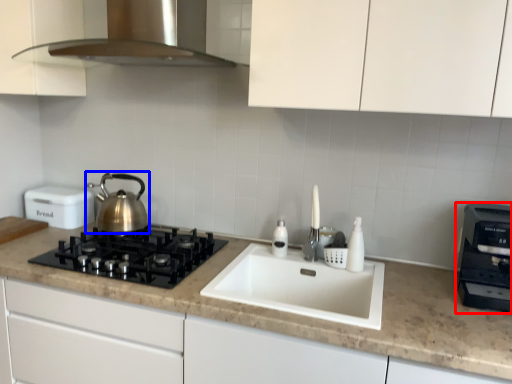
Question: Among these objects, which one is farthest to the camera, kitchen appliance (highlighted by a red box) or kettle (highlighted by a blue box)?

Choices:
 (A) kitchen appliance
 (B) kettle

Answer: (B)